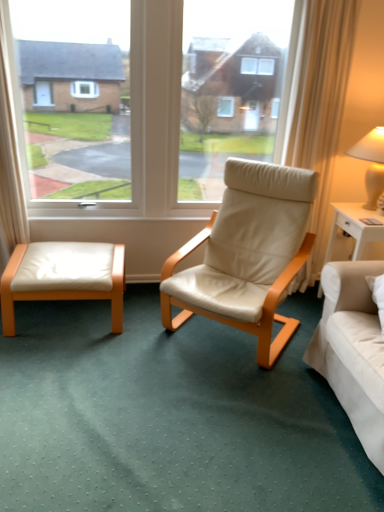
At what (x,y) coordinates should I click in order to perform the action: click on vacant space in front of white leather ottoman at lower left. Please return your answer as a coordinate pair (x, y). Looking at the image, I should click on (68, 364).